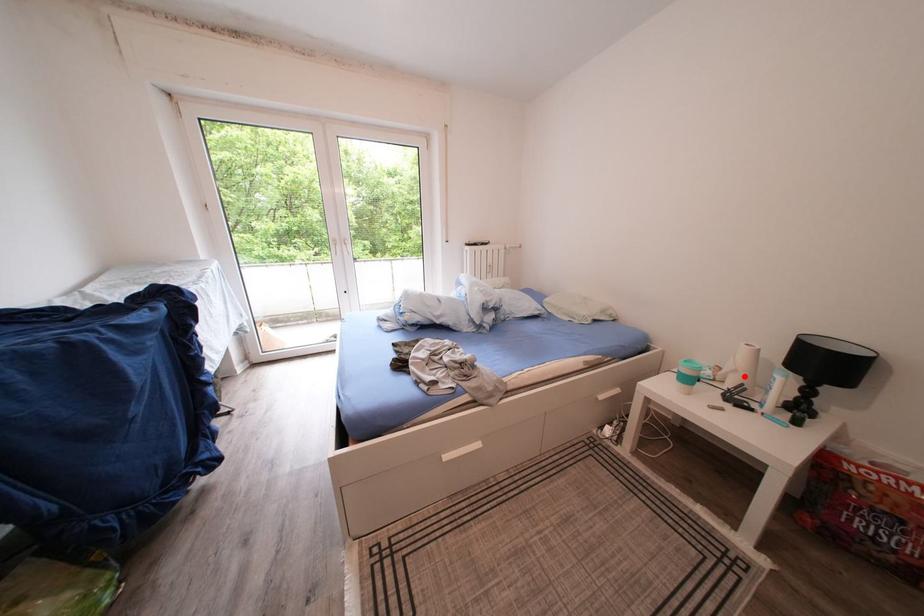
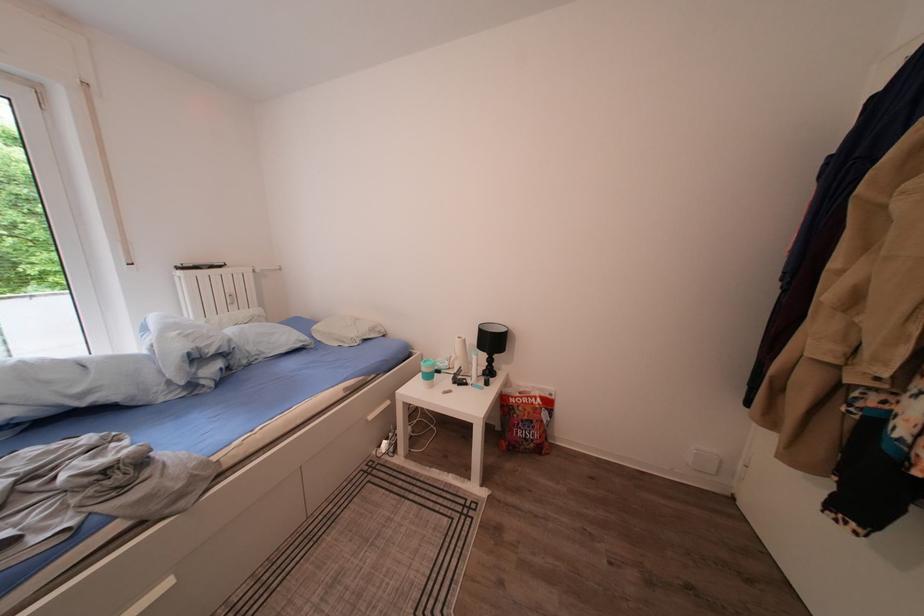
Where in the second image is the point corresponding to the highlighted location from the first image?

(466, 363)